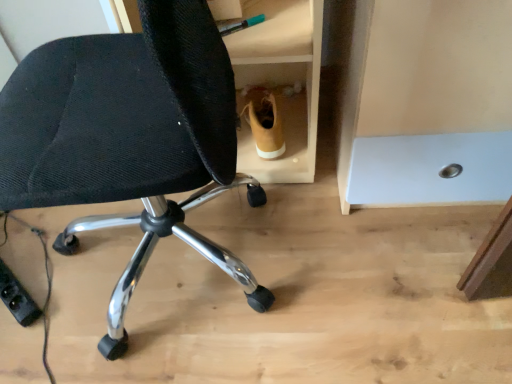
Question: Is black mesh chair at lower left wider or thinner than light brown leather boot at center?

Choices:
 (A) wide
 (B) thin

Answer: (A)

Question: From the image's perspective, is black mesh chair at lower left above or below light brown leather boot at center?

Choices:
 (A) below
 (B) above

Answer: (A)

Question: Considering the positions of black mesh chair at lower left and light brown leather boot at center in the image, is black mesh chair at lower left bigger or smaller than light brown leather boot at center?

Choices:
 (A) big
 (B) small

Answer: (A)

Question: Considering the positions of light brown leather boot at center and black mesh chair at lower left in the image, is light brown leather boot at center bigger or smaller than black mesh chair at lower left?

Choices:
 (A) small
 (B) big

Answer: (A)

Question: Which is correct: light brown leather boot at center is inside black mesh chair at lower left, or outside of it?

Choices:
 (A) inside
 (B) outside

Answer: (B)

Question: Considering their positions, is light brown leather boot at center located in front of or behind black mesh chair at lower left?

Choices:
 (A) behind
 (B) front

Answer: (A)

Question: In terms of width, does light brown leather boot at center look wider or thinner when compared to black mesh chair at lower left?

Choices:
 (A) thin
 (B) wide

Answer: (A)